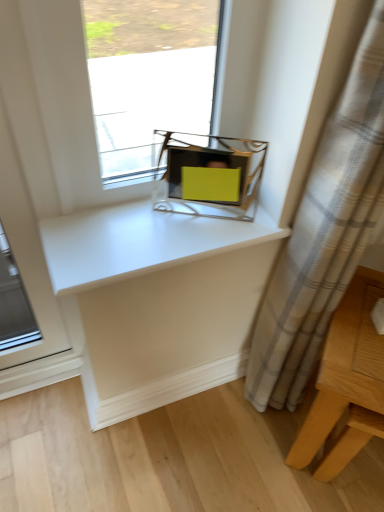
You are a GUI agent. You are given a task and a screenshot of the screen. Output one action in this format:
    pyautogui.click(x=<x>, y=<y>)
    Task: Click on the vacant area to the left of light wood table at lower right
    The height and width of the screenshot is (512, 384).
    Given the screenshot: What is the action you would take?
    pyautogui.click(x=233, y=446)